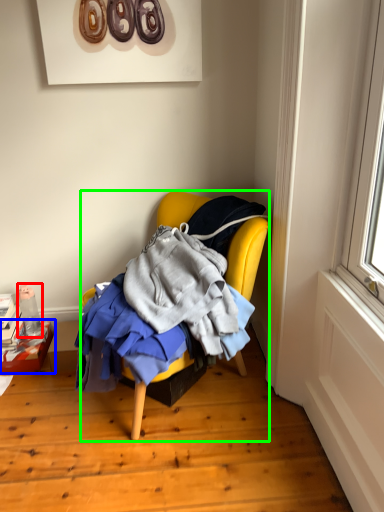
Question: Considering the real-world distances, which object is closest to bottle (highlighted by a red box)? box (highlighted by a blue box) or chair (highlighted by a green box).

Choices:
 (A) box
 (B) chair

Answer: (A)